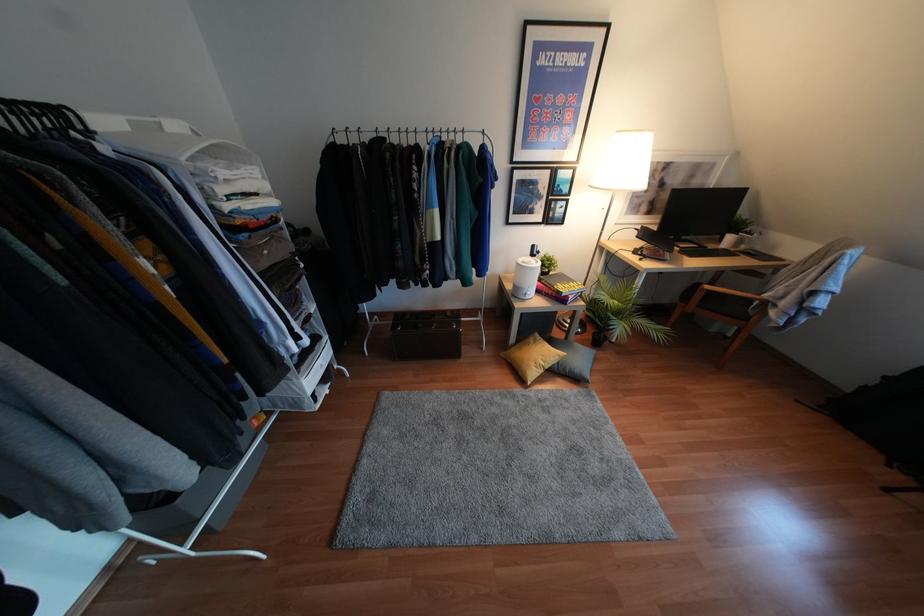
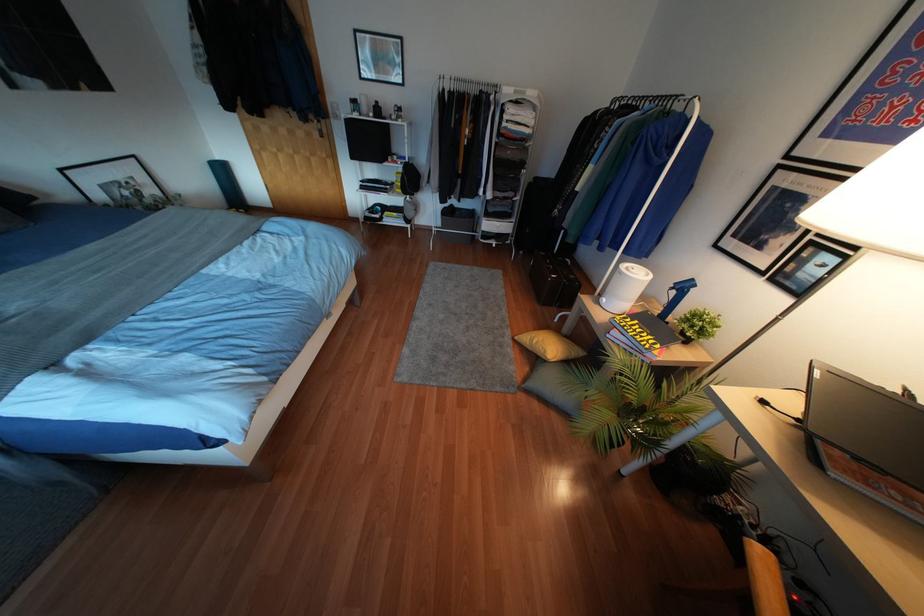
Locate, in the second image, the point that corresponds to (532,246) in the first image.

(690, 280)